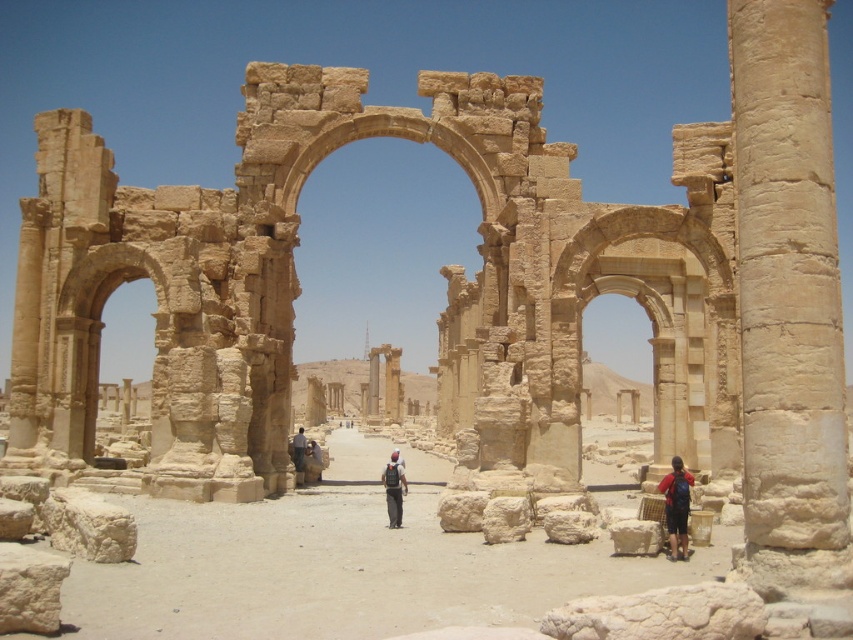
You are standing at the ancient ruins and want to take a photo of the distant view through the archway. To do this, you need to position yourself between the two points marked as point (550, 416) and point (99, 288). Which point should you stand closer to in order to frame the archway properly?

You should stand closer to point (99, 288) because point (550, 416) is in front of point (99, 288). To frame the archway properly, you need to position yourself behind point (550, 416), which would mean standing closer to point (99, 288).

You are standing in front of the ancient ruins and want to take a photo. There are two points marked in the image, point 1 at coordinates point (665, 488) and point 2 at coordinates point (300, 456). Which point is closer to you?

Point (665, 488) is closer to the camera than point (300, 456), so point 1 is closer to you.